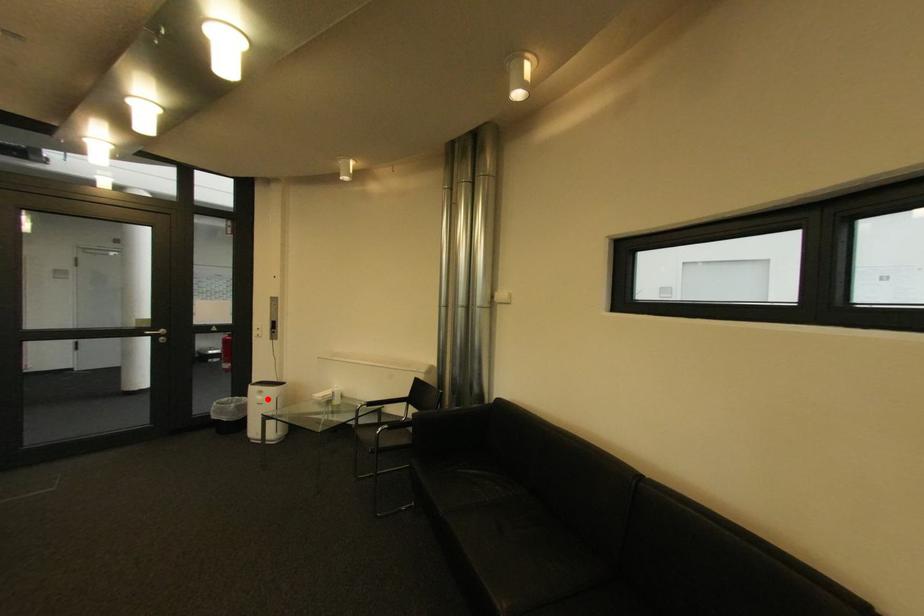
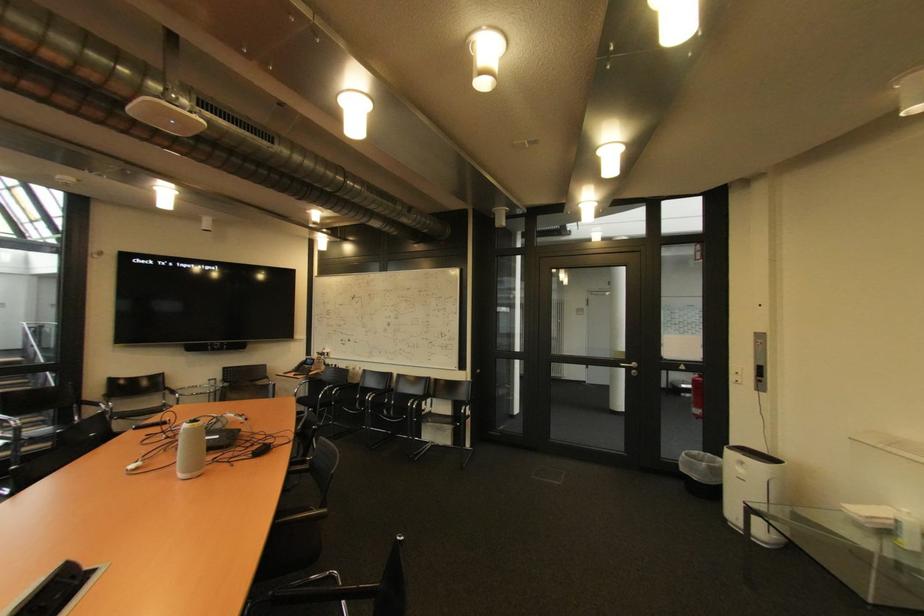
Locate, in the second image, the point that corresponds to the highlighted location in the first image.

(748, 471)